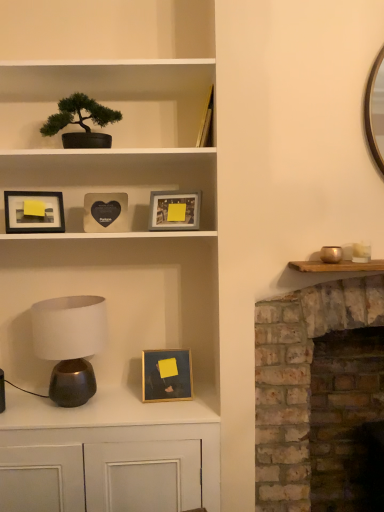
What are the coordinates of `free space in front of gold/glossy picture frame at center, the 4th picture frame in the top-to-bottom sequence` in the screenshot? It's located at (160, 413).